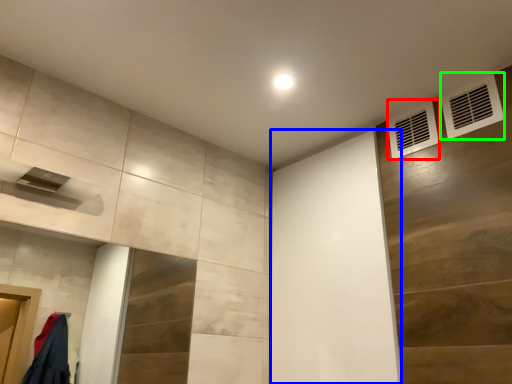
Question: Based on their relative distances, which object is nearer to air conditioning (highlighted by a red box)? Choose from screen door (highlighted by a blue box) and air conditioning (highlighted by a green box).

Choices:
 (A) screen door
 (B) air conditioning

Answer: (B)